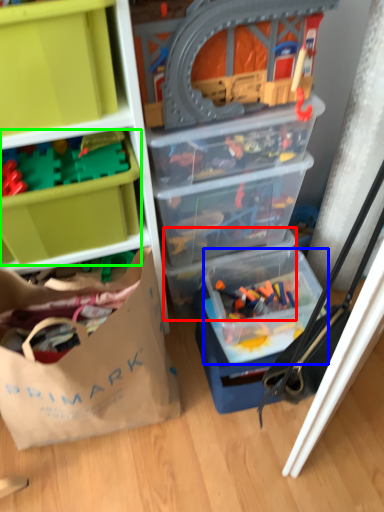
Question: Which is nearer to the storage box (highlighted by a red box)? storage box (highlighted by a blue box) or storage box (highlighted by a green box).

Choices:
 (A) storage box
 (B) storage box

Answer: (A)